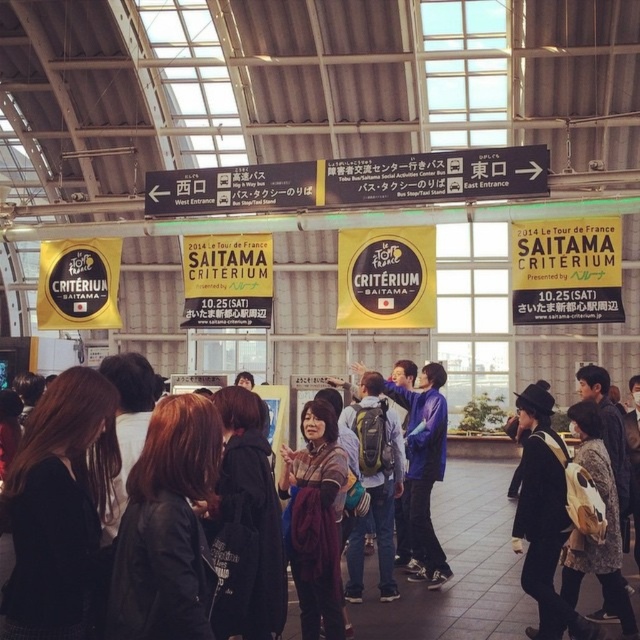
Question: Does dark brown leather jacket at center appear over black leather jacket at center?

Choices:
 (A) yes
 (B) no

Answer: (A)

Question: Estimate the real-world distances between objects in this image. Which object is farther from the matte black backpack at center?

Choices:
 (A) black leather backpack at center
 (B) fur coat at center

Answer: (B)

Question: Does black leather backpack at center have a smaller size compared to matte blue backpack at center?

Choices:
 (A) no
 (B) yes

Answer: (A)

Question: Is dark brown leather jacket at lower left behind matte black backpack at center?

Choices:
 (A) no
 (B) yes

Answer: (A)

Question: Among these objects, which one is farthest from the camera?

Choices:
 (A) maroon fabric scarf at center
 (B) matte black backpack at center

Answer: (B)

Question: Which point is farther from the camera taking this photo?

Choices:
 (A) (305, 532)
 (B) (598, 449)

Answer: (A)